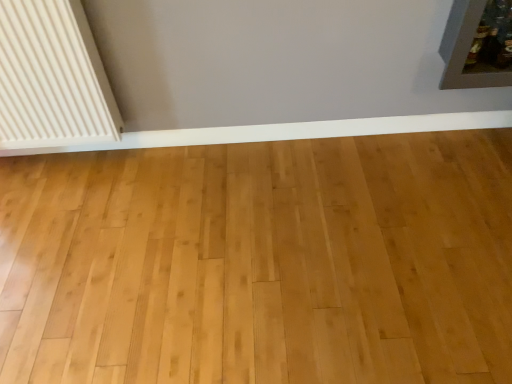
Locate an element on the screen. The height and width of the screenshot is (384, 512). vacant space situated above white smooth baseboard at lower center (from a real-world perspective) is located at coordinates (278, 122).